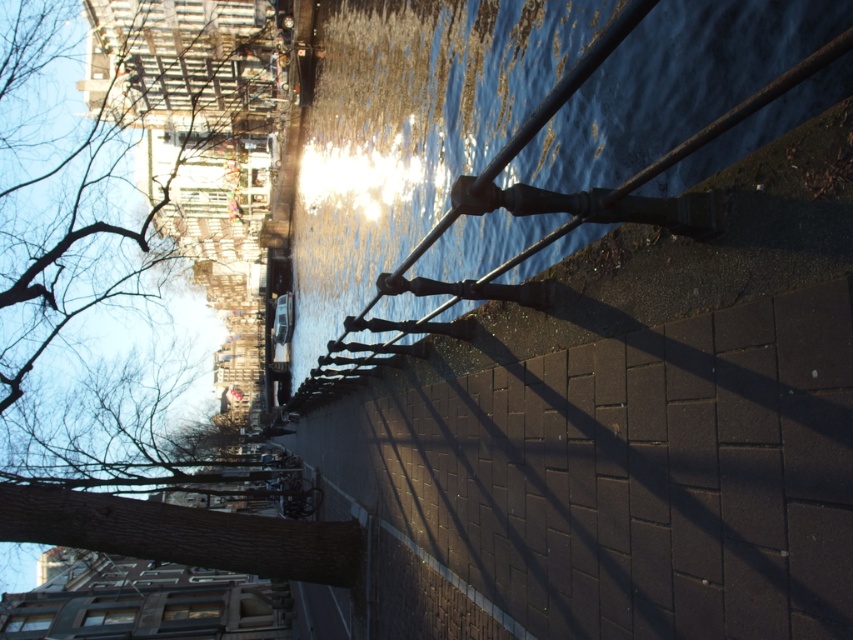
You are standing at the viewpoint of the image and want to walk towards the two points marked in the scene. Which point, point (343, 26) or point (120, 93), will you reach first?

Point (343, 26) is closer to the viewer than point (120, 93), so you will reach point (343, 26) first.

You are a photographer standing at the end of the pathway. You want to capture a photo that includes both the glossy water at center and the brown rough tree at upper left. Which object should you adjust your camera angle to include first if you need to frame both in your shot?

The glossy water at center is thinner than the brown rough tree at upper left, so you should adjust your camera angle to include the glossy water at center first since it has a narrower width and might require more precise framing to fit both objects into the shot.

You are a photographer standing on the pathway near the canal. You want to capture a photo that includes both the glossy water at center and the brown rough tree at upper left. Based on their positions, which object should you position closer to the bottom of your camera frame?

The glossy water at center is below the brown rough tree at upper left, so to include both in the photo, you should position the glossy water at center closer to the bottom of the frame and the brown rough tree at upper left near the top.